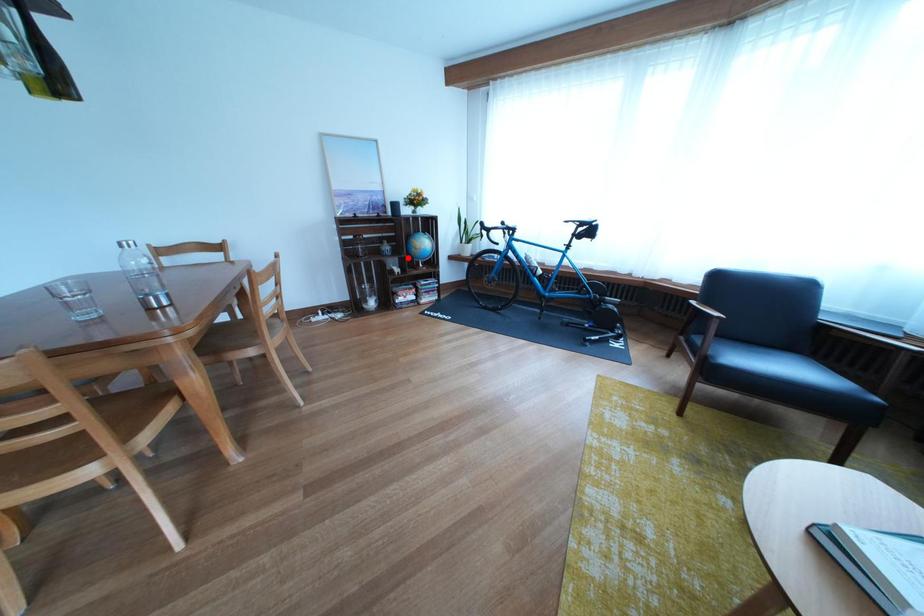
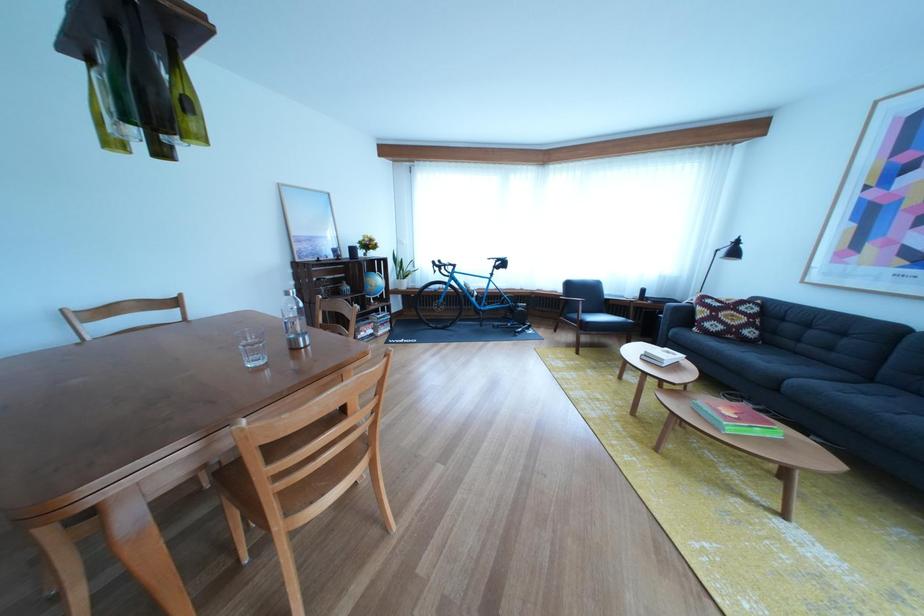
Find the pixel in the second image that matches the highlighted location in the first image.

(367, 297)